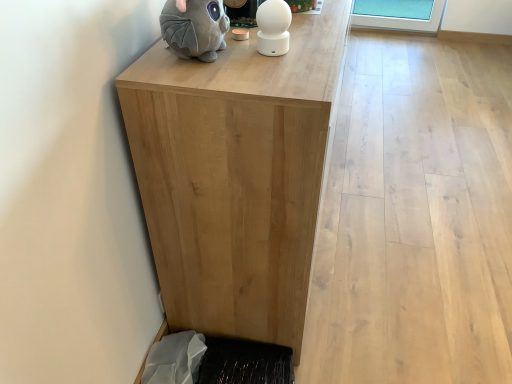
Question: In terms of height, does gray plush toy at upper left look taller or shorter compared to white glossy ball at upper center?

Choices:
 (A) tall
 (B) short

Answer: (A)

Question: From the image's perspective, is gray plush toy at upper left positioned above or below white glossy ball at upper center?

Choices:
 (A) above
 (B) below

Answer: (A)

Question: Based on their relative distances, which object is farther from the white glossy ball at upper center?

Choices:
 (A) natural wood table at center
 (B) black textured mat at lower left
 (C) gray plush toy at upper left

Answer: (B)

Question: Estimate the real-world distances between objects in this image. Which object is farther from the black textured mat at lower left?

Choices:
 (A) white glossy ball at upper center
 (B) natural wood table at center
 (C) gray plush toy at upper left

Answer: (C)